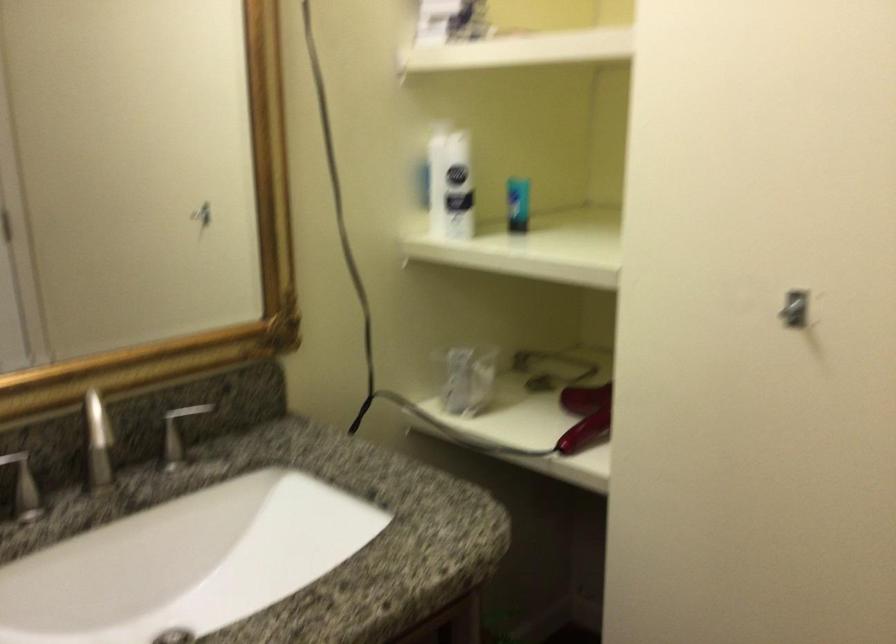
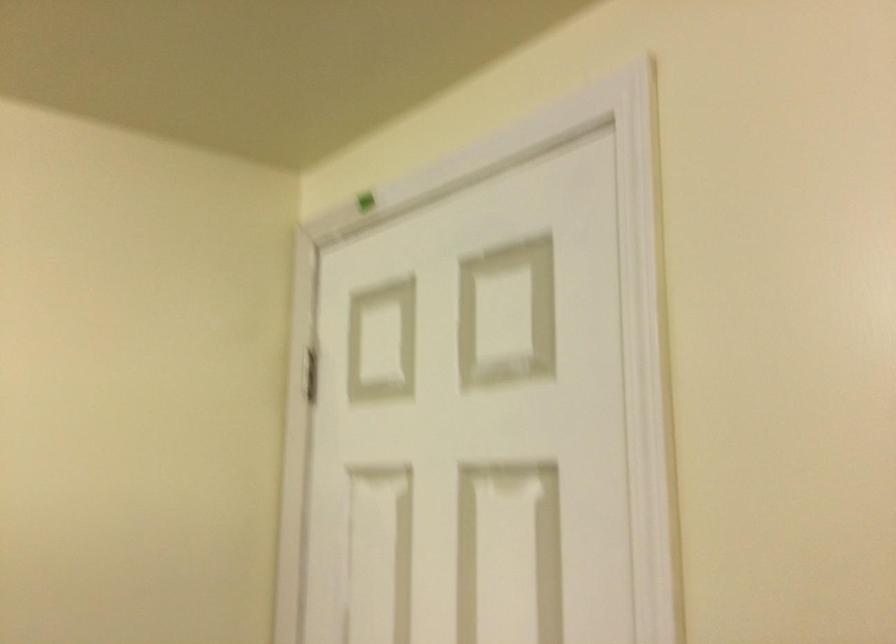
Question: The camera is either moving clockwise (left) or counter-clockwise (right) around the object. The first image is from the beginning of the video and the second image is from the end. Is the camera moving left or right when shooting the video?

Choices:
 (A) Left
 (B) Right

Answer: (A)